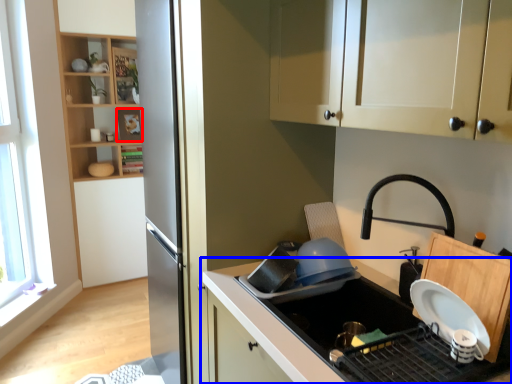
Question: Which object appears farthest to the camera in this image, shelf (highlighted by a red box) or countertop (highlighted by a blue box)?

Choices:
 (A) shelf
 (B) countertop

Answer: (A)